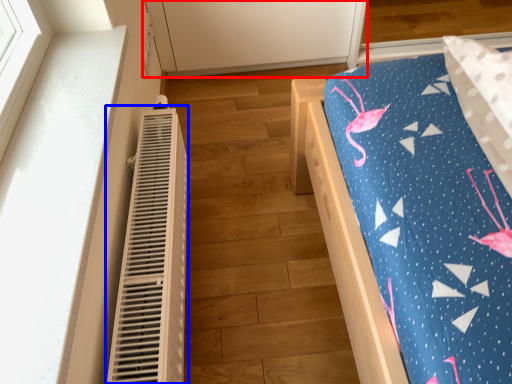
Question: Which object is further to the camera taking this photo, cabinetry (highlighted by a red box) or heater (highlighted by a blue box)?

Choices:
 (A) cabinetry
 (B) heater

Answer: (A)